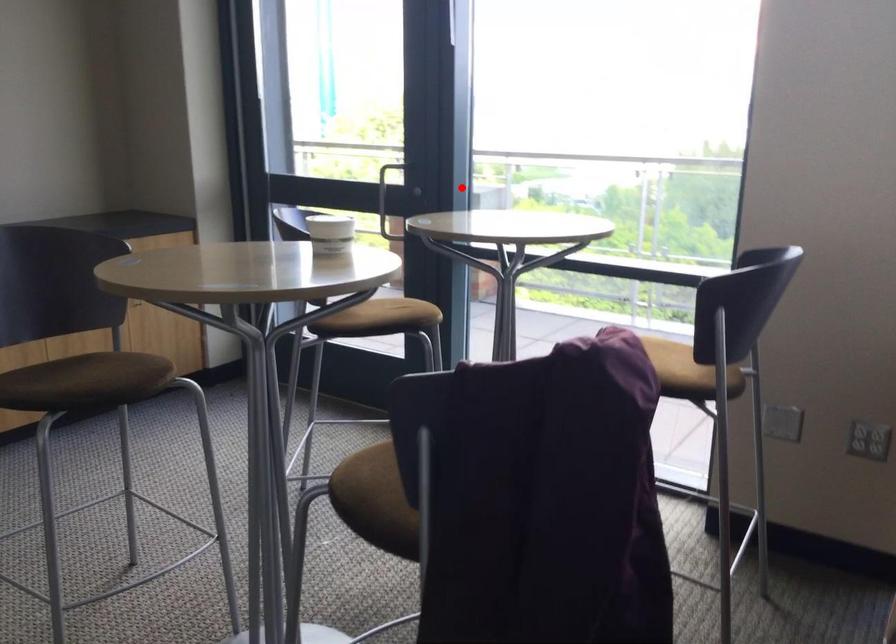
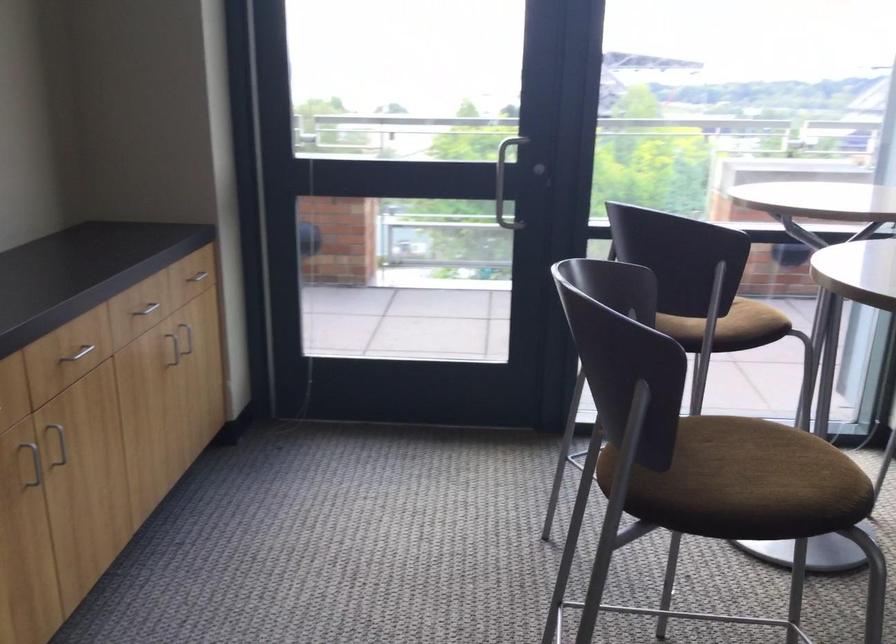
The point at the highlighted location is marked in the first image. Where is the corresponding point in the second image?

(503, 173)